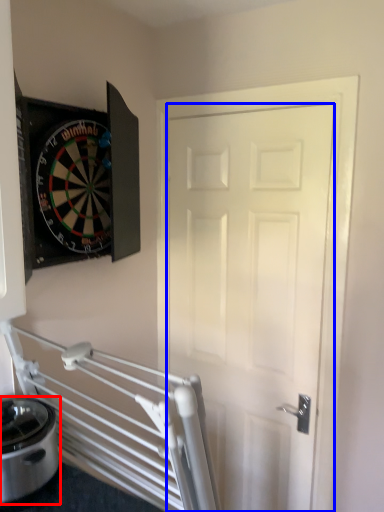
Question: Which point is further to the camera, appliance (highlighted by a red box) or door (highlighted by a blue box)?

Choices:
 (A) appliance
 (B) door

Answer: (B)